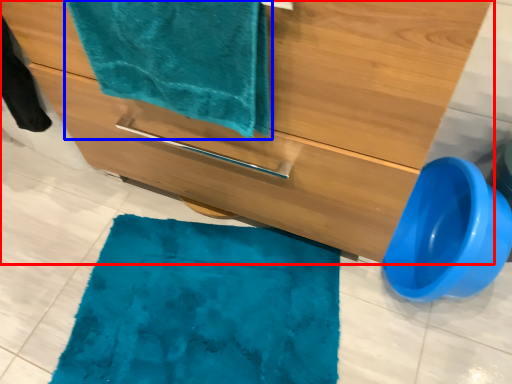
Question: Which point is further to the camera, bathroom cabinet (highlighted by a red box) or towel (highlighted by a blue box)?

Choices:
 (A) bathroom cabinet
 (B) towel

Answer: (B)